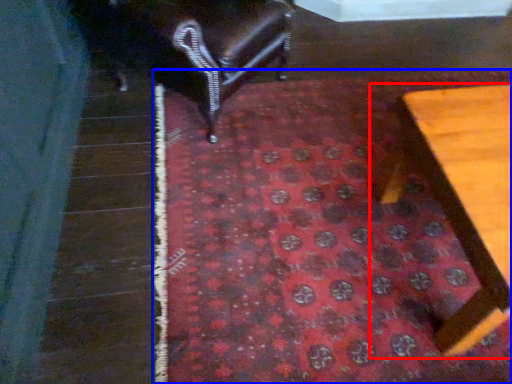
Question: Which object is further to the camera taking this photo, furniture (highlighted by a red box) or mat (highlighted by a blue box)?

Choices:
 (A) furniture
 (B) mat

Answer: (B)